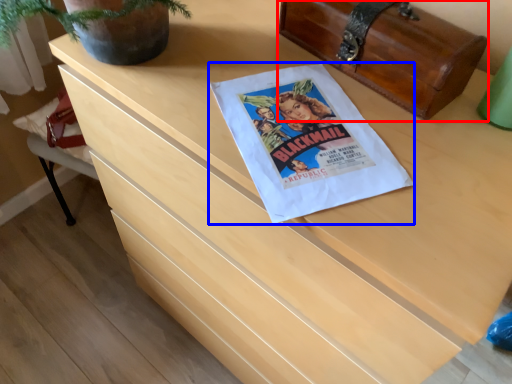
Question: Which object is further to the camera taking this photo, chest (highlighted by a red box) or flyer (highlighted by a blue box)?

Choices:
 (A) chest
 (B) flyer

Answer: (A)